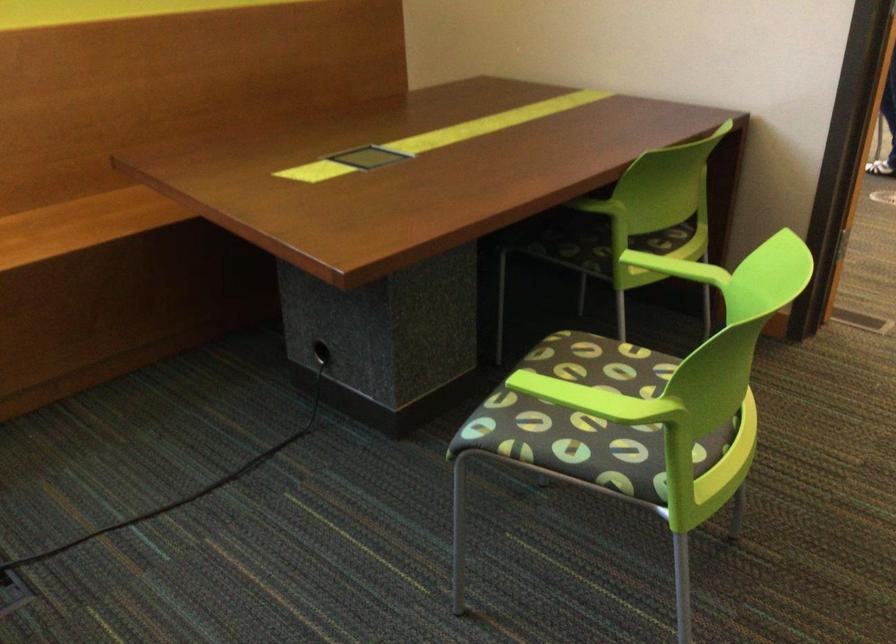
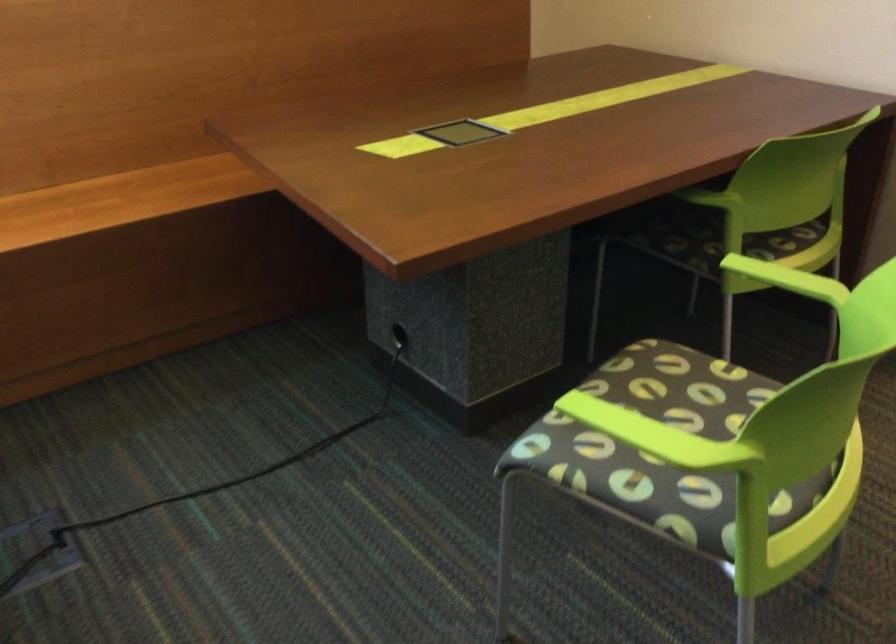
Based on the photo, which direction would the cameraman need to move to produce the second image?

The cameraman walked toward right, forward.